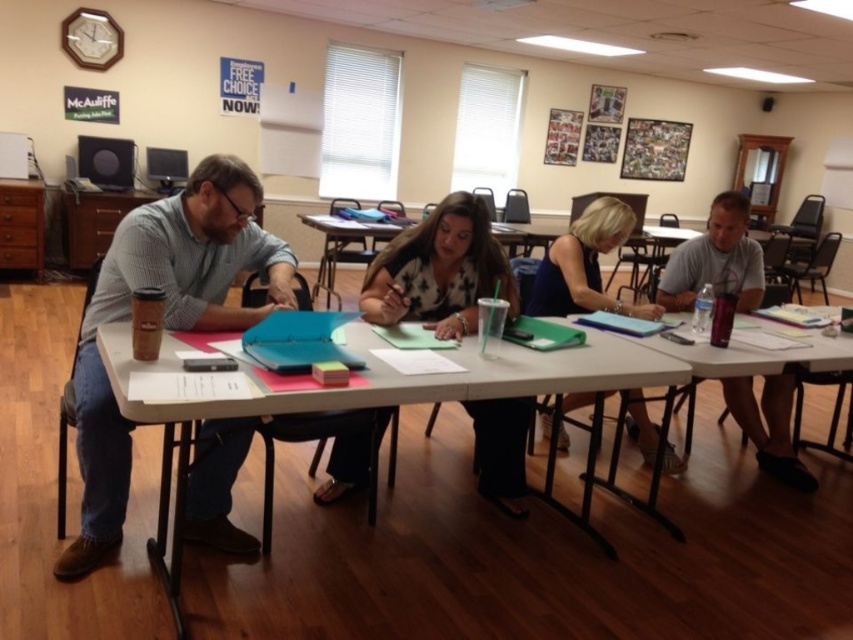
Question: Which of the following is the farthest from the observer?

Choices:
 (A) clear plastic water bottle at lower right
 (B) gray fabric shirt at right
 (C) matte black woman at center
 (D) white plastic table at center

Answer: (B)

Question: In this image, where is clear plastic water bottle at lower right located relative to blue fabric dress at center?

Choices:
 (A) above
 (B) below

Answer: (B)

Question: Observing the image, what is the correct spatial positioning of matte gray shirt at left in reference to white plastic table at center?

Choices:
 (A) above
 (B) below

Answer: (A)

Question: Does matte gray shirt at left have a lesser width compared to clear plastic water bottle at lower right?

Choices:
 (A) no
 (B) yes

Answer: (B)

Question: Which point is farther from the camera taking this photo?

Choices:
 (A) (194, 416)
 (B) (512, 291)
 (C) (737, 342)

Answer: (C)

Question: Which point is closer to the camera taking this photo?

Choices:
 (A) (720, 353)
 (B) (556, 285)

Answer: (A)